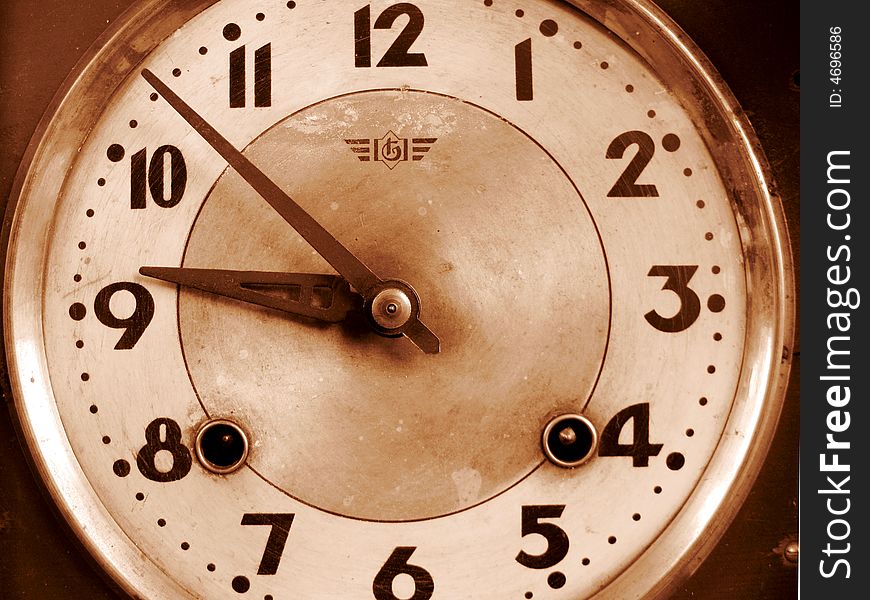
Where is `wall`? wall is located at coordinates (41, 40).